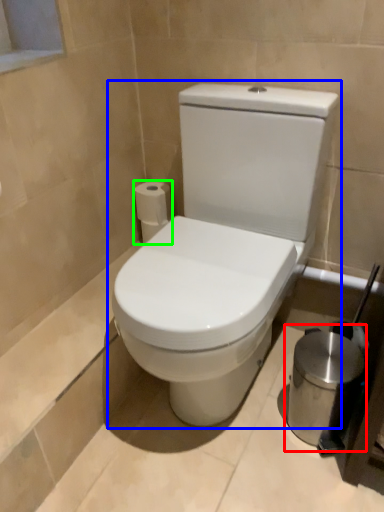
Question: Which object is positioned closest to appliance (highlighted by a red box)? Select from toilet (highlighted by a blue box) and toilet paper (highlighted by a green box).

Choices:
 (A) toilet
 (B) toilet paper

Answer: (A)